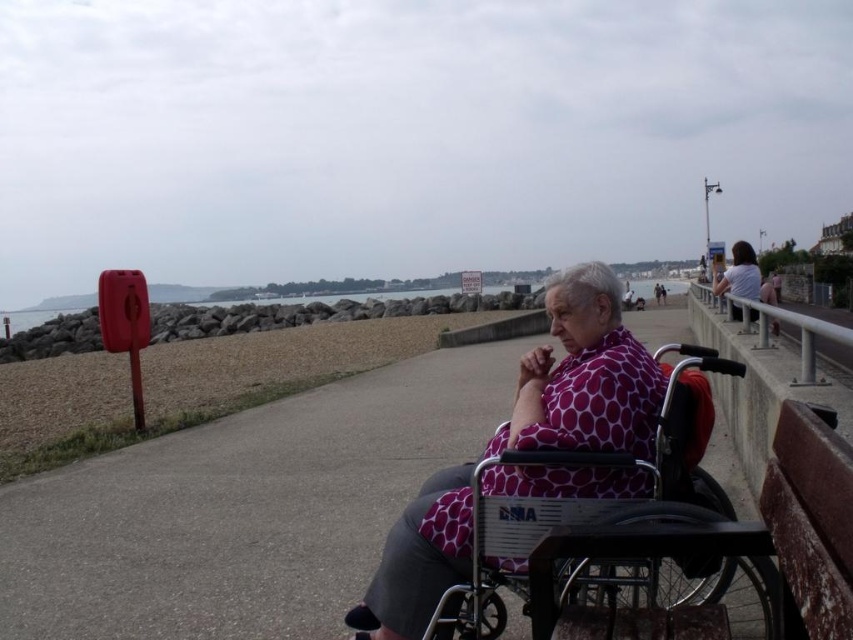
Question: Which point appears farthest from the camera in this image?

Choices:
 (A) (245, 554)
 (B) (490, 502)

Answer: (A)

Question: Does concrete at center appear on the left side of metallic silver wheelchair at center?

Choices:
 (A) no
 (B) yes

Answer: (A)

Question: Does concrete at center appear on the right side of metallic silver wheelchair at center?

Choices:
 (A) no
 (B) yes

Answer: (B)

Question: From the image, what is the correct spatial relationship of concrete at center in relation to polka dot fabric at center?

Choices:
 (A) below
 (B) above

Answer: (B)

Question: Which of the following is the closest to the observer?

Choices:
 (A) (728, 586)
 (B) (641, 477)
 (C) (202, 618)

Answer: (B)

Question: Which point is farther to the camera?

Choices:
 (A) metallic silver wheelchair at center
 (B) concrete at center

Answer: (B)